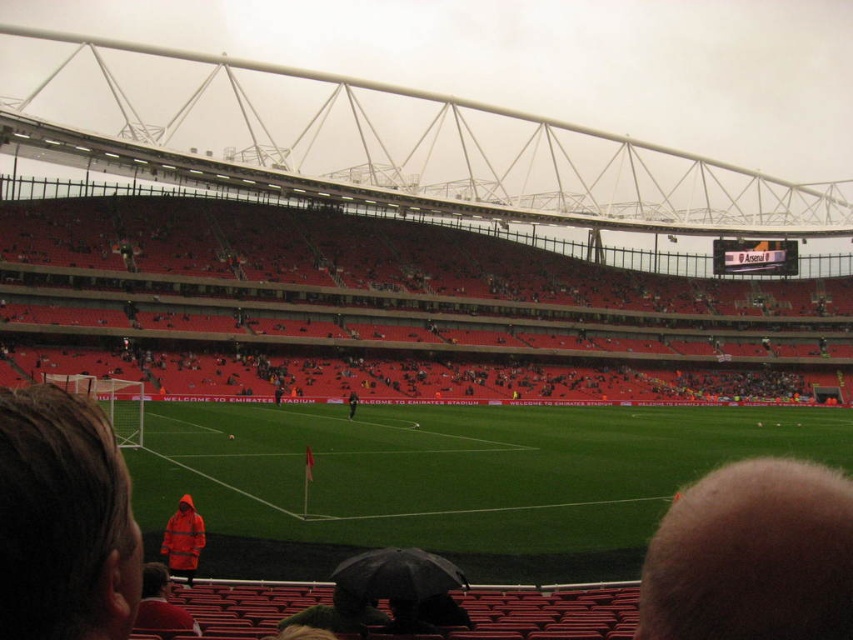
Does orange raincoat at lower left have a greater width compared to red matte jacket at lower left?

→ Indeed, orange raincoat at lower left has a greater width compared to red matte jacket at lower left.

Who is taller, orange raincoat at lower left or red matte jacket at lower left?

orange raincoat at lower left

Measure the distance between orange raincoat at lower left and camera.

They are 26.85 meters apart.

Find the location of a particular element. The width and height of the screenshot is (853, 640). orange raincoat at lower left is located at coordinates (62, 520).

Does green grass football field at center have a greater height compared to orange raincoat at center?

Yes.

Who is taller, green grass football field at center or orange raincoat at center?

Standing taller between the two is green grass football field at center.

Does point (846, 426) come behind point (354, 412)?

Yes, point (846, 426) is farther from viewer.

You are a GUI agent. You are given a task and a screenshot of the screen. Output one action in this format:
    pyautogui.click(x=<x>, y=<y>)
    Task: Click on the green grass football field at center
    This screenshot has height=640, width=853.
    Given the screenshot: What is the action you would take?
    pyautogui.click(x=456, y=468)

Does green grass football field at center appear on the left side of black matte umbrella at lower center?

In fact, green grass football field at center is to the right of black matte umbrella at lower center.

The width and height of the screenshot is (853, 640). Find the location of `green grass football field at center`. green grass football field at center is located at coordinates (456, 468).